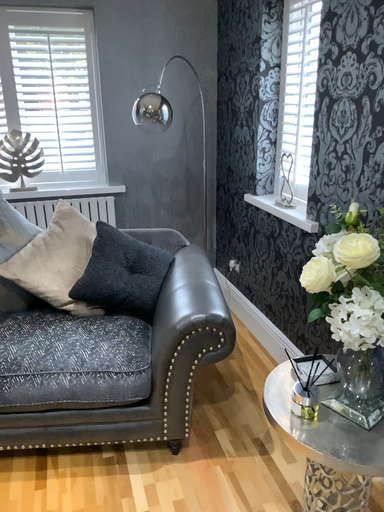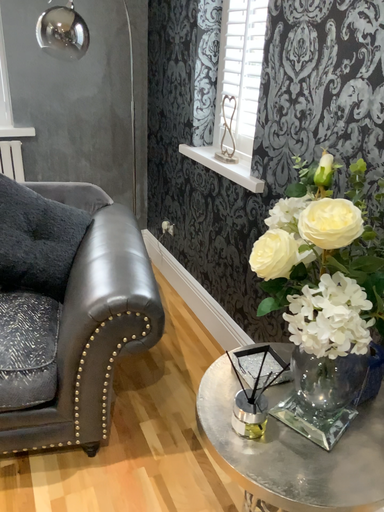
Question: How did the camera likely rotate when shooting the video?

Choices:
 (A) rotated left
 (B) rotated right

Answer: (B)